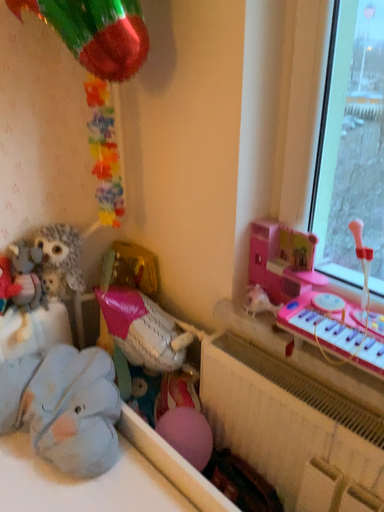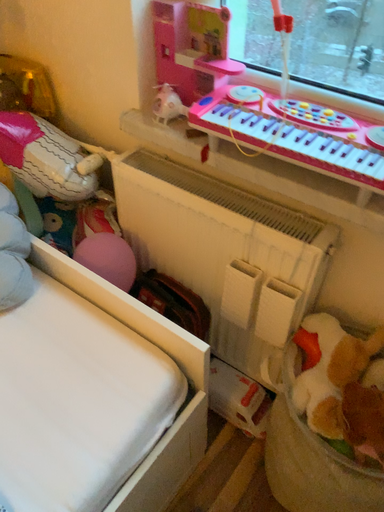
Question: How did the camera likely rotate when shooting the video?

Choices:
 (A) rotated upward
 (B) rotated downward

Answer: (B)